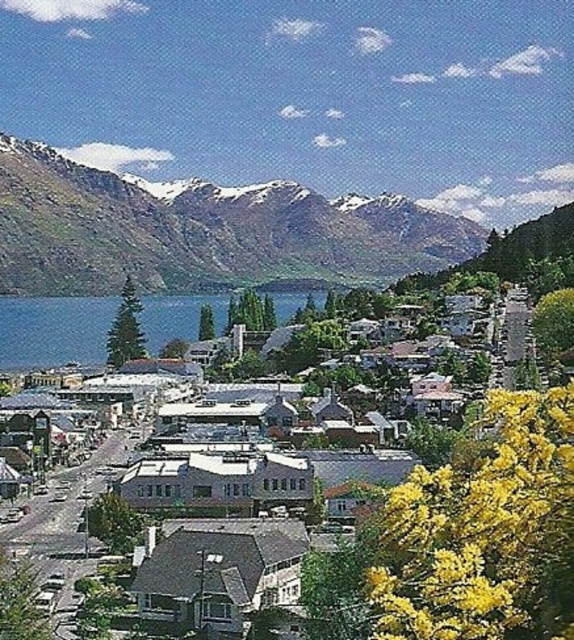
Question: Which point is farther from the camera taking this photo?

Choices:
 (A) (x=20, y=368)
 (B) (x=60, y=333)

Answer: (B)

Question: Among these points, which one is nearest to the camera?

Choices:
 (A) (452, 241)
 (B) (282, 316)
 (C) (55, 314)

Answer: (C)

Question: Is snowy rocky mountain at upper left wider than white matte building at center?

Choices:
 (A) no
 (B) yes

Answer: (B)

Question: Is snowy rocky mountain at upper left positioned before blue water at center?

Choices:
 (A) yes
 (B) no

Answer: (B)

Question: Can you confirm if blue water at center is smaller than white matte building at center?

Choices:
 (A) no
 (B) yes

Answer: (B)

Question: Which point appears closest to the camera in this image?

Choices:
 (A) (29, 321)
 (B) (25, 304)

Answer: (A)